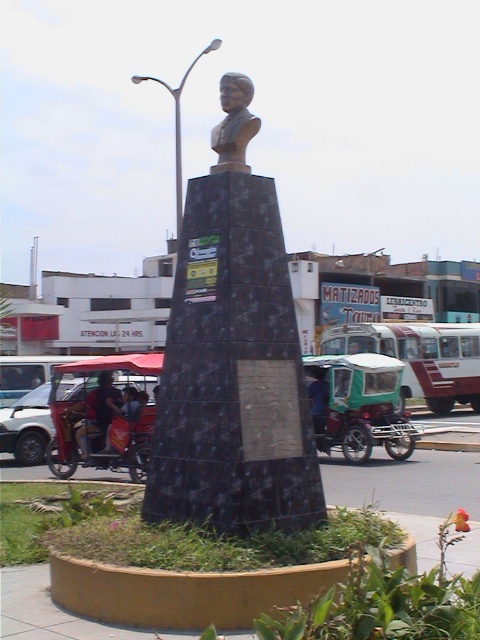
You are a photographer standing in front of the monument. You want to capture a photo that includes both the bronze bust at center and the dark blue fabric shirt at center. Considering their sizes, which object should you focus on to ensure both are clearly visible in the frame?

The bronze bust at center is much taller than the dark blue fabric shirt at center, so you should focus on the bronze bust at center to ensure both are clearly visible in the frame.

You are a photographer standing in front of the monument. You want to capture a photo where both the bronze bust at center and the dark blue fabric shirt at center are visible. Based on their positions, which object should you place on the left side of your photo frame?

The bronze bust at center should be placed on the left side of your photo frame because it is positioned to the left of the dark blue fabric shirt at center.

You are standing in front of the monument and want to take a photo of both the silver metallic lamp post at upper center and the metallic helmet at center. Which object should you focus on first to ensure both are in frame?

You should focus on the silver metallic lamp post at upper center first because it is much taller than the metallic helmet at center, so you need to adjust the camera angle to include its full height while still capturing the helmet in the frame.